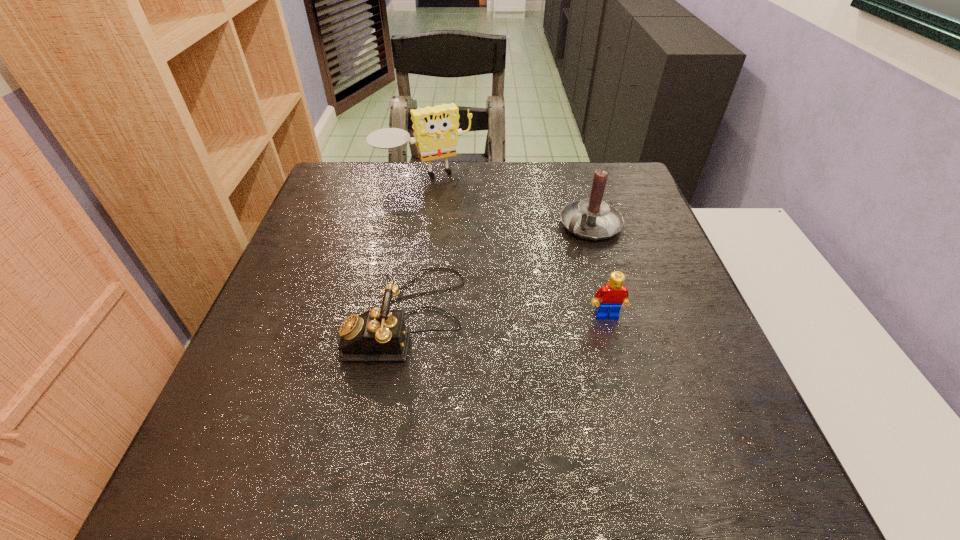
The image size is (960, 540). Identify the location of empty space that is in between the telephone and the Lego. (507, 316).

Find the location of a particular element. This screenshot has width=960, height=540. vacant region between the telephone and the second farthest object is located at coordinates (499, 271).

Identify the location of blank region between the Lego and the tallest object. The image size is (960, 540). (516, 247).

Find the location of a particular element. This screenshot has height=540, width=960. vacant point located between the Lego and the telephone is located at coordinates coord(507,316).

Where is `empty location between the telephone and the third shortest object`? empty location between the telephone and the third shortest object is located at coordinates (499, 271).

Where is `vacant area between the telephone and the farthest object`? The height and width of the screenshot is (540, 960). vacant area between the telephone and the farthest object is located at coordinates (416, 247).

Where is `vacant area between the telephone and the Lego`? vacant area between the telephone and the Lego is located at coordinates (507, 316).

At what (x,y) coordinates should I click in order to perform the action: click on vacant space in between the farthest object and the Lego. Please return your answer as a coordinate pair (x, y). This screenshot has width=960, height=540. Looking at the image, I should click on (516, 247).

Find the location of `the second closest object relative to the tallest object`. the second closest object relative to the tallest object is located at coordinates (379, 334).

Identify which object is located as the third nearest to the Lego. Please provide its 2D coordinates. Your answer should be formatted as a tuple, i.e. [(x, y)], where the tuple contains the x and y coordinates of a point satisfying the conditions above.

[(436, 132)]